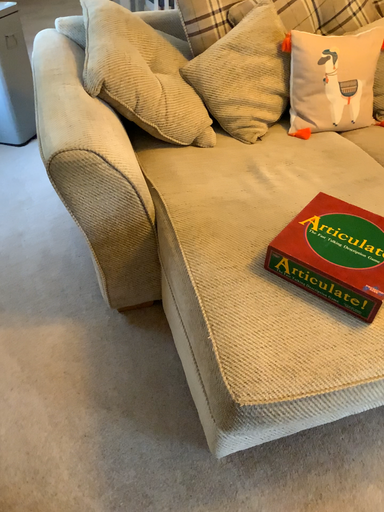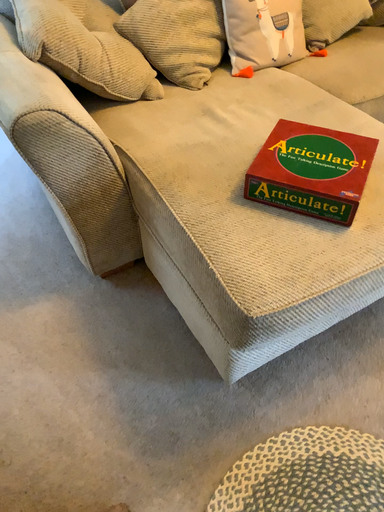
Question: How did the camera likely rotate when shooting the video?

Choices:
 (A) rotated right
 (B) rotated left

Answer: (A)